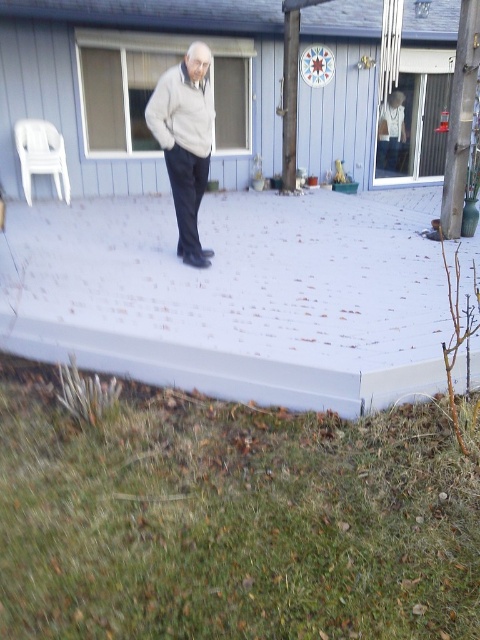
Who is higher up, green grass at lower left or white plastic chair at left?

Positioned higher is white plastic chair at left.

Who is positioned more to the right, green grass at lower left or white plastic chair at left?

From the viewer's perspective, green grass at lower left appears more on the right side.

This screenshot has width=480, height=640. What do you see at coordinates (230, 518) in the screenshot?
I see `green grass at lower left` at bounding box center [230, 518].

This screenshot has height=640, width=480. I want to click on green grass at lower left, so tap(230, 518).

Between white matte sweater at center and white plastic chair at left, which one has more height?

white matte sweater at center is taller.

Can you confirm if white matte sweater at center is positioned to the right of white plastic chair at left?

Indeed, white matte sweater at center is positioned on the right side of white plastic chair at left.

What do you see at coordinates (184, 141) in the screenshot? I see `white matte sweater at center` at bounding box center [184, 141].

At what (x,y) coordinates should I click in order to perform the action: click on white matte sweater at center. Please return your answer as a coordinate pair (x, y). The width and height of the screenshot is (480, 640). Looking at the image, I should click on (184, 141).

Which of these two, white concrete porch at center or white plastic chair at left, stands taller?

With more height is white plastic chair at left.

Does white concrete porch at center have a lesser width compared to white plastic chair at left?

Incorrect, white concrete porch at center's width is not less than white plastic chair at left's.

Locate an element on the screen. white concrete porch at center is located at coordinates (237, 296).